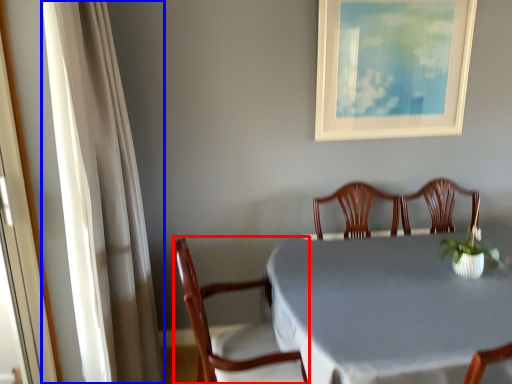
Question: Among these objects, which one is nearest to the camera, chair (highlighted by a red box) or curtain (highlighted by a blue box)?

Choices:
 (A) chair
 (B) curtain

Answer: (B)